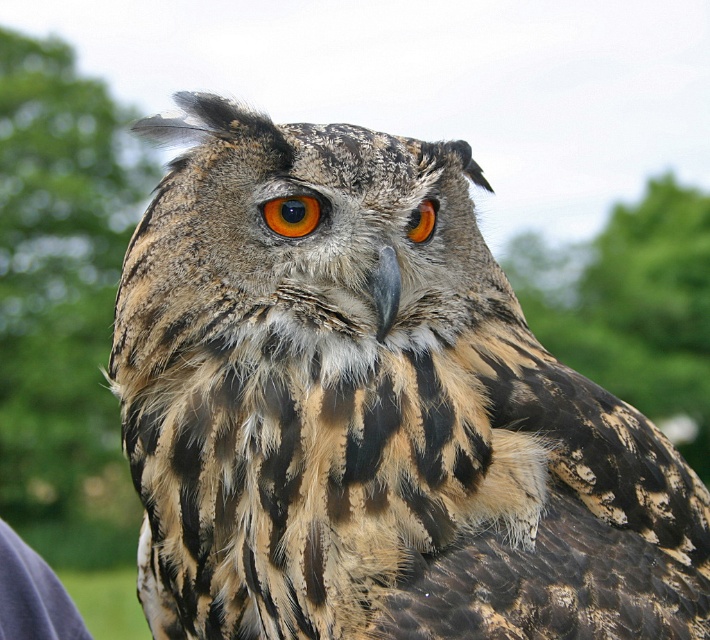
Question: Among these objects, which one is farthest from the camera?

Choices:
 (A) brown speckled owl at center
 (B) brown textured eye at center
 (C) green leafy tree at upper left

Answer: (C)

Question: Does brown textured feathers at upper right have a larger size compared to brown textured eye at center?

Choices:
 (A) yes
 (B) no

Answer: (A)

Question: Does green leafy tree at upper left appear over brown textured eye at center?

Choices:
 (A) no
 (B) yes

Answer: (B)

Question: Can you confirm if green leafy tree at upper left is positioned below brown textured feathers at upper right?

Choices:
 (A) yes
 (B) no

Answer: (B)

Question: Which point is closer to the camera?

Choices:
 (A) (80, 304)
 (B) (518, 488)
 (C) (275, 205)
 (D) (413, 234)

Answer: (B)

Question: Among these objects, which one is farthest from the camera?

Choices:
 (A) orange-brown textured eye at center
 (B) green leafy tree at upper left
 (C) brown textured eye at center
 (D) brown textured feathers at upper right

Answer: (D)